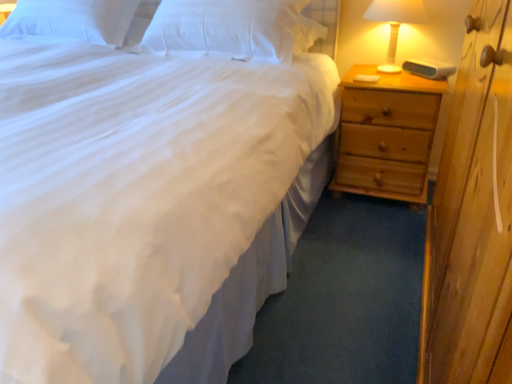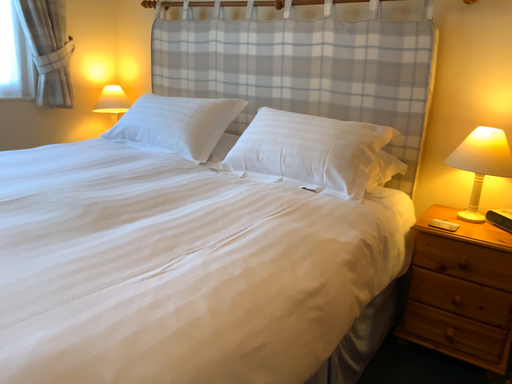
Question: Which way did the camera rotate in the video?

Choices:
 (A) rotated upward
 (B) rotated downward

Answer: (A)